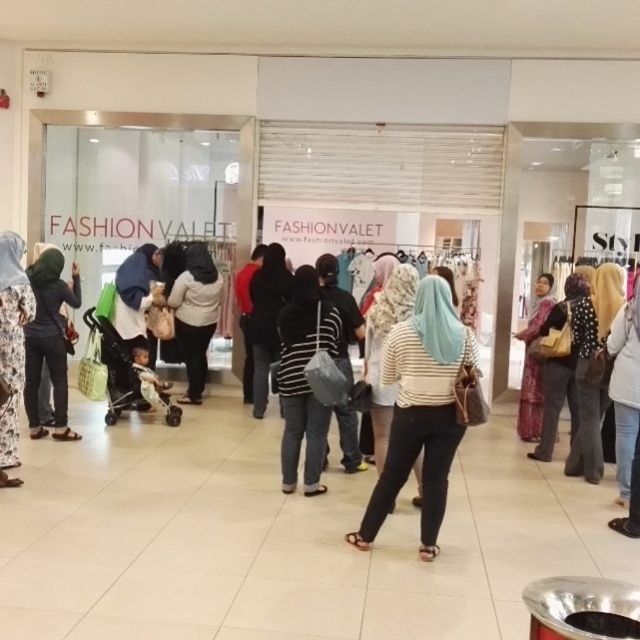
You are a delivery person who just arrived at the mall with a package for the FashionValet store. You need to place the package on the floor between the striped fabric bag at center and the white matte coat at center. The package is 3 feet long. Is there enough space between them to place the package?

The striped fabric bag at center is 8.64 feet from the white matte coat at center. Since the package is only 3 feet long, there is sufficient space between them to place the package.

You are standing in front of the FASHIONVALET store and want to pick up the striped fabric bag at center. Where should you look to find it?

The striped fabric bag at center is located at point (304, 380).

You are standing at the point closest to the store entrance in the shopping mall scene. There are two points marked in the image, one at coordinates point (301,380) and another at point (40,321). Which of these points is closer to the store entrance?

Point (40,321) is closer to the store entrance because it is behind point (301,380), which is in front of it.